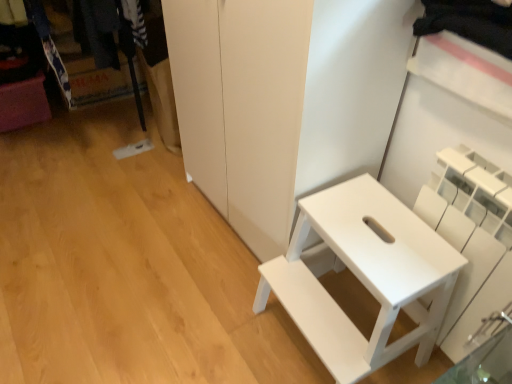
Locate an element on the screen. The height and width of the screenshot is (384, 512). blank space situated above white matte step stool at right (from a real-world perspective) is located at coordinates (373, 233).